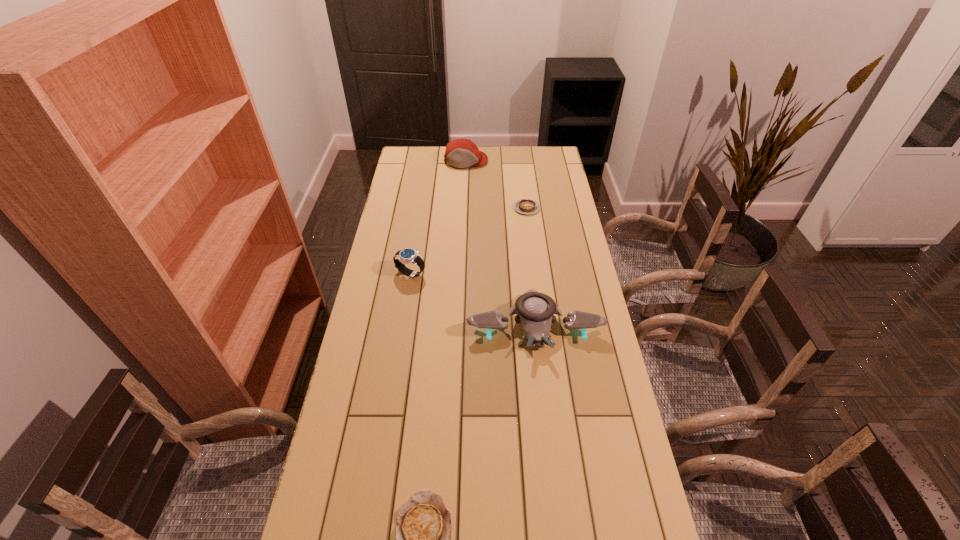
Find the location of a particular element. This screenshot has height=540, width=960. free space between the cap and the watch is located at coordinates (438, 217).

The width and height of the screenshot is (960, 540). Find the location of `vacant space that's between the second farthest object and the watch`. vacant space that's between the second farthest object and the watch is located at coordinates (468, 241).

Identify the location of empty space between the watch and the cap. This screenshot has width=960, height=540. (438, 217).

This screenshot has width=960, height=540. Identify the location of object identified as the closest to the fourth nearest object. (460, 153).

Locate an element on the screen. Image resolution: width=960 pixels, height=540 pixels. object that is the third nearest to the shorter quiche is located at coordinates (525, 206).